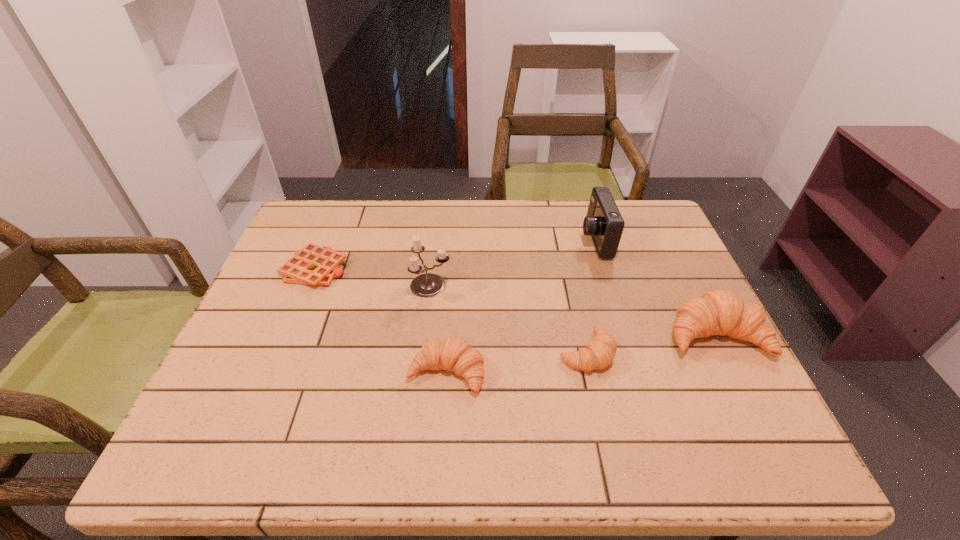
In order to click on free region located 0.330m on the left of the second shortest crescent roll in this screenshot , I will do `click(257, 372)`.

Locate an element on the screen. This screenshot has width=960, height=540. free region located 0.230m on the back of the shortest crescent roll is located at coordinates (567, 267).

Locate an element on the screen. The width and height of the screenshot is (960, 540). free region located 0.280m on the back of the fourth shortest object is located at coordinates (668, 239).

At what (x,y) coordinates should I click in order to perform the action: click on blank space located 0.200m on the front of the shortest object. Please return your answer as a coordinate pair (x, y). This screenshot has height=540, width=960. Looking at the image, I should click on (280, 353).

Image resolution: width=960 pixels, height=540 pixels. I want to click on free location located 0.270m on the front-facing side of the camera, so click(489, 240).

At what (x,y) coordinates should I click in order to perform the action: click on free space located on the front-facing side of the camera. Please return your answer as a coordinate pair (x, y). This screenshot has width=960, height=540. Looking at the image, I should click on (471, 240).

Locate an element on the screen. The width and height of the screenshot is (960, 540). vacant space located on the front-facing side of the camera is located at coordinates (451, 240).

The image size is (960, 540). In order to click on free space located 0.310m on the right of the candle holder in this screenshot , I will do `click(569, 285)`.

Find the location of a particular element. object that is at the far edge is located at coordinates (604, 223).

Locate an element on the screen. The image size is (960, 540). object present at the near edge is located at coordinates (455, 354).